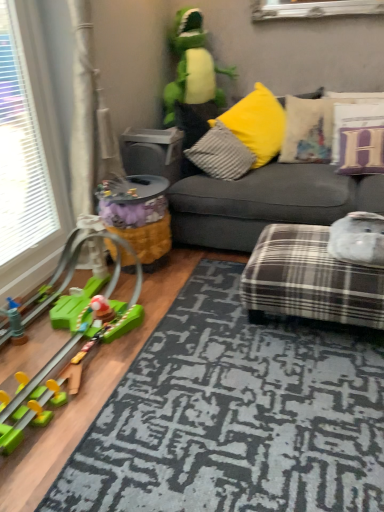
The height and width of the screenshot is (512, 384). Identify the location of gray textured pillow at center, the 3th pillow from the right. (220, 154).

Describe the element at coordinates (71, 345) in the screenshot. I see `green plastic toy at left, which ranks as the 1th toy in bottom-to-top order` at that location.

Identify the location of purple fabric pillow at upper right, the 3th pillow when ordered from left to right. This screenshot has width=384, height=512. (358, 138).

What is the approximate width of gray fabric couch at center, the 1th studio couch in the top-to-bottom sequence?

gray fabric couch at center, the 1th studio couch in the top-to-bottom sequence, is 1.22 meters in width.

How much space does yellow fabric toy at center, placed as the second toy when sorted from bottom to top, occupy vertically?

It is 18.95 inches.

In order to face plaid fabric ottoman at lower right, the first studio couch positioned from the bottom, should I rotate leftwards or rightwards?

Rotate your view right by about 16.321°.

Measure the distance between point (255,297) and camera.

1.80 meters.

Find the location of a particular element. The height and width of the screenshot is (512, 384). velvet beige pillow at upper right, the second pillow viewed from the left is located at coordinates (309, 129).

Is green plush toy at upper center, positioned as the 1th toy in top-to-bottom order, placed right next to plaid fabric ottoman at lower right, positioned as the 2th studio couch in top-to-bottom order?

No, green plush toy at upper center, positioned as the 1th toy in top-to-bottom order, is not in contact with plaid fabric ottoman at lower right, positioned as the 2th studio couch in top-to-bottom order.

From the image's perspective, is green plush toy at upper center, which is the 3th toy from bottom to top, under plaid fabric ottoman at lower right, the first studio couch positioned from the bottom?

No, from the image's perspective, green plush toy at upper center, which is the 3th toy from bottom to top, is not beneath plaid fabric ottoman at lower right, the first studio couch positioned from the bottom.

You are a GUI agent. You are given a task and a screenshot of the screen. Output one action in this format:
    pyautogui.click(x=<x>, y=<y>)
    Task: Click on the toy that is the 2nd object located above the plaid fabric ottoman at lower right, the first studio couch positioned from the bottom (from the image's perspective)
    
    Given the screenshot: What is the action you would take?
    pyautogui.click(x=192, y=66)

From a real-world perspective, between green plush toy at upper center, positioned as the 1th toy in top-to-bottom order, and plaid fabric ottoman at lower right, positioned as the 2th studio couch in top-to-bottom order, who is vertically lower?

From a 3D spatial view, plaid fabric ottoman at lower right, positioned as the 2th studio couch in top-to-bottom order, is below.

Is green plastic toy at left, which ranks as the 1th toy in bottom-to-top order, facing away from green plush toy at upper center, which is the 3th toy from bottom to top?

That's not correct — green plastic toy at left, which ranks as the 1th toy in bottom-to-top order, is not looking away from green plush toy at upper center, which is the 3th toy from bottom to top.

Which object is positioned more to the right, green plastic toy at left, which is the 3th toy in top-to-bottom order, or green plush toy at upper center, positioned as the 1th toy in top-to-bottom order?

green plush toy at upper center, positioned as the 1th toy in top-to-bottom order.

Considering the relative sizes of green plastic toy at left, which is the 3th toy in top-to-bottom order, and green plush toy at upper center, which is the 3th toy from bottom to top, in the image provided, is green plastic toy at left, which is the 3th toy in top-to-bottom order, taller than green plush toy at upper center, which is the 3th toy from bottom to top,?

Incorrect, the height of green plastic toy at left, which is the 3th toy in top-to-bottom order, is not larger of that of green plush toy at upper center, which is the 3th toy from bottom to top.

Can you confirm if green plastic toy at left, which is the 3th toy in top-to-bottom order, is wider than green plush toy at upper center, positioned as the 1th toy in top-to-bottom order?

Indeed, green plastic toy at left, which is the 3th toy in top-to-bottom order, has a greater width compared to green plush toy at upper center, positioned as the 1th toy in top-to-bottom order.

Does yellow fabric toy at center, which is counted as the 2th toy, starting from the top, appear on the left side of velvet beige pillow at upper right, the second pillow viewed from the left?

Correct, you'll find yellow fabric toy at center, which is counted as the 2th toy, starting from the top, to the left of velvet beige pillow at upper right, the second pillow viewed from the left.

Are yellow fabric toy at center, placed as the second toy when sorted from bottom to top, and velvet beige pillow at upper right, positioned as the 2th pillow in right-to-left order, located far from each other?

Yes, yellow fabric toy at center, placed as the second toy when sorted from bottom to top, and velvet beige pillow at upper right, positioned as the 2th pillow in right-to-left order, are located far from each other.

Could you tell me if yellow fabric toy at center, placed as the second toy when sorted from bottom to top, is turned towards velvet beige pillow at upper right, the second pillow viewed from the left?

No, yellow fabric toy at center, placed as the second toy when sorted from bottom to top, is not facing towards velvet beige pillow at upper right, the second pillow viewed from the left.

Who is smaller, plaid fabric ottoman at lower right, positioned as the 2th studio couch in top-to-bottom order, or purple fabric pillow at upper right, marked as the first pillow in a right-to-left arrangement?

purple fabric pillow at upper right, marked as the first pillow in a right-to-left arrangement, is smaller.

Is plaid fabric ottoman at lower right, the first studio couch positioned from the bottom, completely or partially outside of purple fabric pillow at upper right, marked as the first pillow in a right-to-left arrangement?

Yes, plaid fabric ottoman at lower right, the first studio couch positioned from the bottom, is outside of purple fabric pillow at upper right, marked as the first pillow in a right-to-left arrangement.

Is plaid fabric ottoman at lower right, positioned as the 2th studio couch in top-to-bottom order, turned away from purple fabric pillow at upper right, marked as the first pillow in a right-to-left arrangement?

No, purple fabric pillow at upper right, marked as the first pillow in a right-to-left arrangement, is not at the back of plaid fabric ottoman at lower right, positioned as the 2th studio couch in top-to-bottom order.

From a real-world perspective, is plaid fabric ottoman at lower right, the first studio couch positioned from the bottom, physically above purple fabric pillow at upper right, the 3th pillow when ordered from left to right?

No.

Based on the photo, is yellow fabric toy at center, which is counted as the 2th toy, starting from the top, aimed at gray fabric couch at center, the 2th studio couch in the bottom-to-top sequence?

No.

Which of these two, yellow fabric toy at center, which is counted as the 2th toy, starting from the top, or gray fabric couch at center, the 1th studio couch in the top-to-bottom sequence, is smaller?

yellow fabric toy at center, which is counted as the 2th toy, starting from the top.

In the scene shown: From a real-world perspective, who is located higher, yellow fabric toy at center, which is counted as the 2th toy, starting from the top, or gray fabric couch at center, the 2th studio couch in the bottom-to-top sequence?

gray fabric couch at center, the 2th studio couch in the bottom-to-top sequence, is physically above.

Where is `the 1st toy behind the gray fabric couch at center, the 2th studio couch in the bottom-to-top sequence, starting your count from the anchor`? the 1st toy behind the gray fabric couch at center, the 2th studio couch in the bottom-to-top sequence, starting your count from the anchor is located at coordinates (140, 217).

From the picture: Can you confirm if white plastic window at left is bigger than dark gray textured rug at lower center?

Incorrect, white plastic window at left is not larger than dark gray textured rug at lower center.

Do you think white plastic window at left is within dark gray textured rug at lower center, or outside of it?

white plastic window at left is outside dark gray textured rug at lower center.

Does white plastic window at left have a lesser height compared to dark gray textured rug at lower center?

Incorrect, the height of white plastic window at left does not fall short of that of dark gray textured rug at lower center.

There is a dark gray textured rug at lower center. Where is `window above it (from a real-world perspective)`? window above it (from a real-world perspective) is located at coordinates (x=20, y=152).

Is white plastic window at left thinner than yellow fabric toy at center, placed as the second toy when sorted from bottom to top?

Yes, white plastic window at left is thinner than yellow fabric toy at center, placed as the second toy when sorted from bottom to top.

How far apart are white plastic window at left and yellow fabric toy at center, placed as the second toy when sorted from bottom to top?

A distance of 20.49 inches exists between white plastic window at left and yellow fabric toy at center, placed as the second toy when sorted from bottom to top.

From a real-world perspective, is white plastic window at left located beneath yellow fabric toy at center, placed as the second toy when sorted from bottom to top?

No, from a real-world perspective, white plastic window at left is not under yellow fabric toy at center, placed as the second toy when sorted from bottom to top.

Can you tell me how much white plastic window at left and yellow fabric toy at center, placed as the second toy when sorted from bottom to top, differ in facing direction?

The angle between the facing direction of white plastic window at left and the facing direction of yellow fabric toy at center, placed as the second toy when sorted from bottom to top, is 0.292 degrees.

From the green plush toy at upper center, which is the 3th toy from bottom to top, count 2nd studio couchs forward and point to it. Please provide its 2D coordinates.

[(310, 279)]

Locate an element on the screen. The image size is (384, 512). the 2nd toy positioned below the green plush toy at upper center, positioned as the 1th toy in top-to-bottom order (from the image's perspective) is located at coordinates (71, 345).

Looking at the image, which one is located further to plaid fabric ottoman at lower right, positioned as the 2th studio couch in top-to-bottom order, dark gray textured rug at lower center or yellow fabric toy at center, which is counted as the 2th toy, starting from the top?

yellow fabric toy at center, which is counted as the 2th toy, starting from the top.

Considering their positions, is gray fabric couch at center, the 1th studio couch in the top-to-bottom sequence, positioned further to purple fabric pillow at upper right, the 3th pillow when ordered from left to right, than white plastic window at left?

white plastic window at left.

When comparing their distances from purple fabric pillow at upper right, marked as the first pillow in a right-to-left arrangement, does gray textured pillow at center, which is the 1th pillow from left to right, or green plush toy at upper center, which is the 3th toy from bottom to top, seem further?

The object further to purple fabric pillow at upper right, marked as the first pillow in a right-to-left arrangement, is green plush toy at upper center, which is the 3th toy from bottom to top.

Based on their spatial positions, is dark gray textured rug at lower center or gray textured pillow at center, the 3th pillow from the right, closer to green plastic toy at left, which ranks as the 1th toy in bottom-to-top order?

dark gray textured rug at lower center is closer to green plastic toy at left, which ranks as the 1th toy in bottom-to-top order.

Based on their spatial positions, is velvet beige pillow at upper right, positioned as the 2th pillow in right-to-left order, or green plastic toy at left, which is the 3th toy in top-to-bottom order, further from gray textured pillow at center, the 3th pillow from the right?

Based on the image, green plastic toy at left, which is the 3th toy in top-to-bottom order, appears to be further to gray textured pillow at center, the 3th pillow from the right.

Consider the image. Estimate the real-world distances between objects in this image. Which object is further from green plastic toy at left, which is the 3th toy in top-to-bottom order, green plush toy at upper center, positioned as the 1th toy in top-to-bottom order, or purple fabric pillow at upper right, marked as the first pillow in a right-to-left arrangement?

green plush toy at upper center, positioned as the 1th toy in top-to-bottom order, is further to green plastic toy at left, which is the 3th toy in top-to-bottom order.

Based on their spatial positions, is velvet beige pillow at upper right, positioned as the 2th pillow in right-to-left order, or white plastic window at left closer to yellow fabric toy at center, placed as the second toy when sorted from bottom to top?

white plastic window at left.

From the picture: Looking at the image, which one is located further to white plastic window at left, gray textured pillow at center, which is the 1th pillow from left to right, or purple fabric pillow at upper right, marked as the first pillow in a right-to-left arrangement?

purple fabric pillow at upper right, marked as the first pillow in a right-to-left arrangement.

Find the location of a particular element. The height and width of the screenshot is (512, 384). toy between green plastic toy at left, which is the 3th toy in top-to-bottom order, and gray textured pillow at center, the 3th pillow from the right, from front to back is located at coordinates (140, 217).

Find the location of a particular element. The image size is (384, 512). pillow between dark gray textured rug at lower center and purple fabric pillow at upper right, the 3th pillow when ordered from left to right, in the front-back direction is located at coordinates (220, 154).

Where is `studio couch situated between white plastic window at left and plaid fabric ottoman at lower right, the first studio couch positioned from the bottom, from left to right`? The width and height of the screenshot is (384, 512). studio couch situated between white plastic window at left and plaid fabric ottoman at lower right, the first studio couch positioned from the bottom, from left to right is located at coordinates (266, 203).

This screenshot has height=512, width=384. What are the coordinates of `window between green plastic toy at left, which is the 3th toy in top-to-bottom order, and gray textured pillow at center, the 3th pillow from the right, along the z-axis` in the screenshot? It's located at (20, 152).